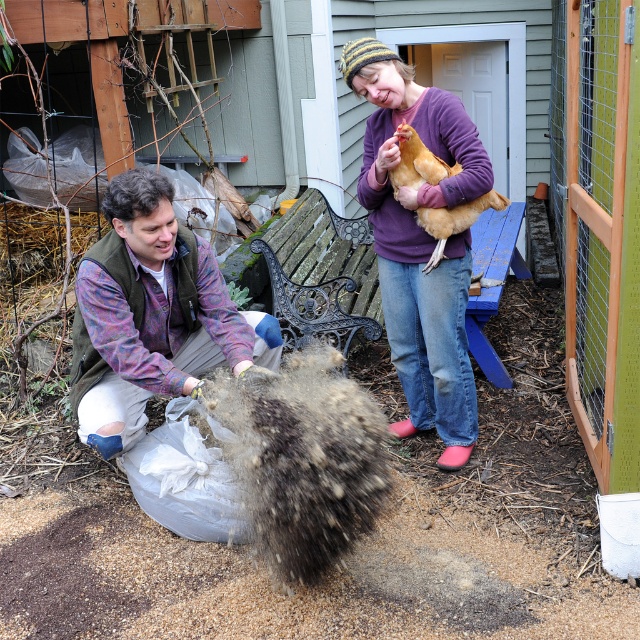
Question: Is ripped denim jeans at lower left closer to the viewer compared to golden feathered chicken at upper right?

Choices:
 (A) yes
 (B) no

Answer: (A)

Question: Considering the real-world distances, which object is closest to the purple soft sweater at center?

Choices:
 (A) ripped denim jeans at lower left
 (B) golden feathered chicken at upper right

Answer: (B)

Question: From the image, what is the correct spatial relationship of ripped denim jeans at lower left in relation to golden feathered chicken at upper right?

Choices:
 (A) right
 (B) left

Answer: (B)

Question: Which point appears farthest from the camera in this image?

Choices:
 (A) pyautogui.click(x=163, y=364)
 (B) pyautogui.click(x=440, y=253)
 (C) pyautogui.click(x=388, y=280)

Answer: (C)

Question: Is ripped denim jeans at lower left to the left of purple soft sweater at center from the viewer's perspective?

Choices:
 (A) yes
 (B) no

Answer: (A)

Question: Estimate the real-world distances between objects in this image. Which object is farther from the golden feathered chicken at upper right?

Choices:
 (A) ripped denim jeans at lower left
 (B) purple soft sweater at center

Answer: (A)